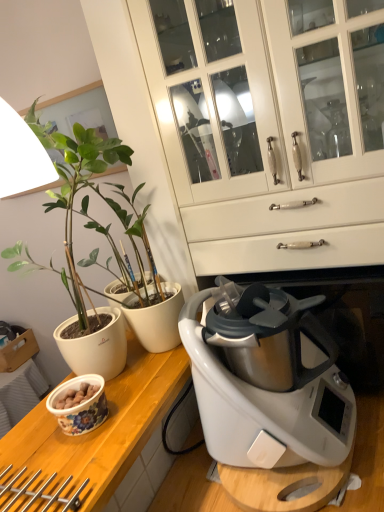
Question: Can you confirm if matte white pot at left is bigger than white glossy cabinet at center?

Choices:
 (A) no
 (B) yes

Answer: (A)

Question: Could you tell me if matte white pot at left is turned towards white glossy cabinet at center?

Choices:
 (A) yes
 (B) no

Answer: (B)

Question: Is matte white pot at left positioned before white glossy cabinet at center?

Choices:
 (A) yes
 (B) no

Answer: (A)

Question: Would you say matte white pot at left is a long distance from white glossy cabinet at center?

Choices:
 (A) yes
 (B) no

Answer: (B)

Question: From a real-world perspective, is matte white pot at left beneath white glossy cabinet at center?

Choices:
 (A) no
 (B) yes

Answer: (B)

Question: Is matte white pot at left at the right side of white glossy cabinet at center?

Choices:
 (A) yes
 (B) no

Answer: (B)

Question: Is wooden at left outside floral ceramic bowl at lower left?

Choices:
 (A) yes
 (B) no

Answer: (A)

Question: Does wooden at left have a lesser height compared to floral ceramic bowl at lower left?

Choices:
 (A) no
 (B) yes

Answer: (A)

Question: Does wooden at left have a larger size compared to floral ceramic bowl at lower left?

Choices:
 (A) yes
 (B) no

Answer: (A)

Question: Can you confirm if wooden at left is wider than floral ceramic bowl at lower left?

Choices:
 (A) no
 (B) yes

Answer: (B)

Question: Does wooden at left come behind floral ceramic bowl at lower left?

Choices:
 (A) no
 (B) yes

Answer: (A)

Question: Considering the relative sizes of wooden at left and floral ceramic bowl at lower left in the image provided, is wooden at left thinner than floral ceramic bowl at lower left?

Choices:
 (A) yes
 (B) no

Answer: (B)

Question: Does matte white pot at left have a smaller size compared to floral ceramic bowl at lower left?

Choices:
 (A) yes
 (B) no

Answer: (B)